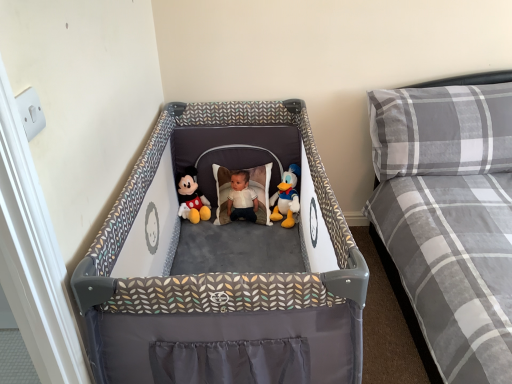
Question: In the image, is gray plaid mattress at right positioned in front of or behind gray plaid pillow at upper right?

Choices:
 (A) front
 (B) behind

Answer: (A)

Question: Is gray plaid mattress at right bigger or smaller than gray plaid pillow at upper right?

Choices:
 (A) small
 (B) big

Answer: (B)

Question: Based on their relative distances, which object is farther from the gray plaid pillow at upper right?

Choices:
 (A) matte plush mickey mouse at center, arranged as the 1th toy when viewed from the left
 (B) gray plaid mattress at right
 (C) white plush duck at center, the 1th toy when ordered from right to left

Answer: (A)

Question: Which object is positioned farthest from the gray plaid mattress at right?

Choices:
 (A) matte plush mickey mouse at center, arranged as the 1th toy when viewed from the left
 (B) gray plaid pillow at upper right
 (C) white plush duck at center, which appears as the 2th toy when viewed from the left

Answer: (A)